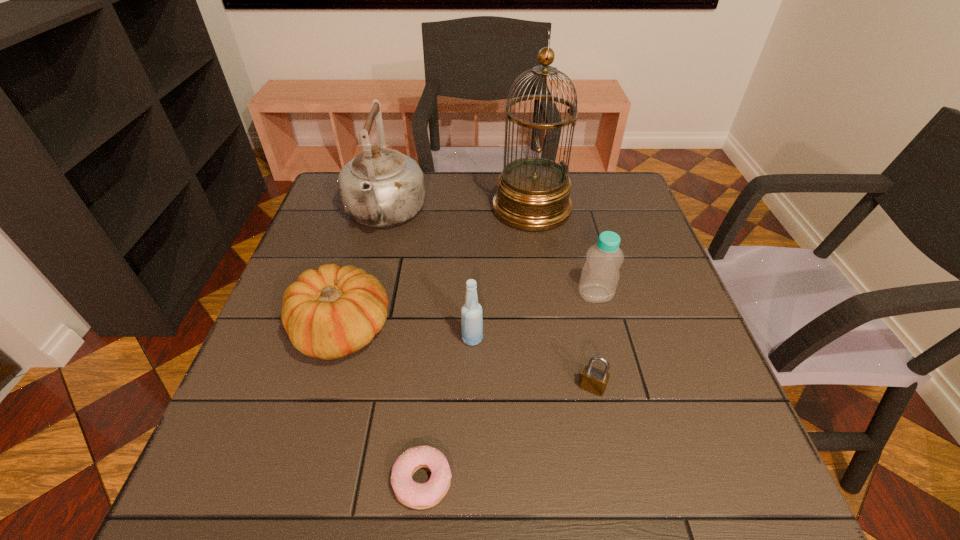
You are a GUI agent. You are given a task and a screenshot of the screen. Output one action in this format:
    pyautogui.click(x=<x>, y=<y>)
    Task: Click on the tallest object
    
    Given the screenshot: What is the action you would take?
    pyautogui.click(x=533, y=193)

Identify the location of kettle. (380, 187).

Identify the location of the farther bottle. This screenshot has height=540, width=960. (600, 275).

Locate an element on the screen. The height and width of the screenshot is (540, 960). the nearer bottle is located at coordinates (471, 312).

Where is `the left bottle`? This screenshot has width=960, height=540. the left bottle is located at coordinates click(471, 312).

Find the location of a particular element. The height and width of the screenshot is (540, 960). gourd is located at coordinates (328, 313).

Find the location of a particular element. the second shortest object is located at coordinates (594, 380).

The width and height of the screenshot is (960, 540). What are the coordinates of `the second nearest object` in the screenshot? It's located at (594, 380).

Image resolution: width=960 pixels, height=540 pixels. What are the coordinates of `the nearest object` in the screenshot? It's located at (414, 495).

Locate an element on the screen. The width and height of the screenshot is (960, 540). the shortest object is located at coordinates (414, 495).